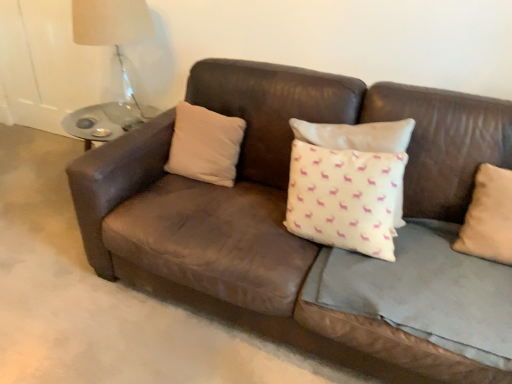
Question: Is translucent glass table lamp at upper left smaller than brown leather couch at center?

Choices:
 (A) no
 (B) yes

Answer: (B)

Question: Does translucent glass table lamp at upper left have a greater height compared to brown leather couch at center?

Choices:
 (A) yes
 (B) no

Answer: (A)

Question: Considering the relative positions of translucent glass table lamp at upper left and brown leather couch at center in the image provided, is translucent glass table lamp at upper left to the right of brown leather couch at center from the viewer's perspective?

Choices:
 (A) no
 (B) yes

Answer: (A)

Question: Is brown leather couch at center surrounded by translucent glass table lamp at upper left?

Choices:
 (A) no
 (B) yes

Answer: (A)

Question: Can you confirm if translucent glass table lamp at upper left is bigger than brown leather couch at center?

Choices:
 (A) no
 (B) yes

Answer: (A)

Question: From the image's perspective, is translucent glass table lamp at upper left above or below white matte pillow at center, the 1th pillow in the left-to-right sequence?

Choices:
 (A) below
 (B) above

Answer: (B)

Question: Is point (137, 8) positioned closer to the camera than point (178, 119)?

Choices:
 (A) closer
 (B) farther

Answer: (B)

Question: Would you say translucent glass table lamp at upper left is inside or outside white matte pillow at center, the 1th pillow in the left-to-right sequence?

Choices:
 (A) outside
 (B) inside

Answer: (A)

Question: In the image, is translucent glass table lamp at upper left positioned in front of or behind white matte pillow at center, which is the second pillow in front-to-back order?

Choices:
 (A) behind
 (B) front

Answer: (A)

Question: Is brown leather couch at center inside or outside of translucent glass table lamp at upper left?

Choices:
 (A) outside
 (B) inside

Answer: (A)

Question: Considering the positions of brown leather couch at center and translucent glass table lamp at upper left in the image, is brown leather couch at center wider or thinner than translucent glass table lamp at upper left?

Choices:
 (A) thin
 (B) wide

Answer: (B)

Question: In the image, is brown leather couch at center positioned in front of or behind translucent glass table lamp at upper left?

Choices:
 (A) behind
 (B) front

Answer: (B)

Question: From a real-world perspective, is brown leather couch at center above or below translucent glass table lamp at upper left?

Choices:
 (A) below
 (B) above

Answer: (A)

Question: From the image's perspective, relative to translucent glass table lamp at upper left, is beige fabric pillow at right, the first pillow from the front, above or below?

Choices:
 (A) above
 (B) below

Answer: (B)

Question: Relative to translucent glass table lamp at upper left, is beige fabric pillow at right, the second pillow in the left-to-right sequence, in front or behind?

Choices:
 (A) front
 (B) behind

Answer: (A)